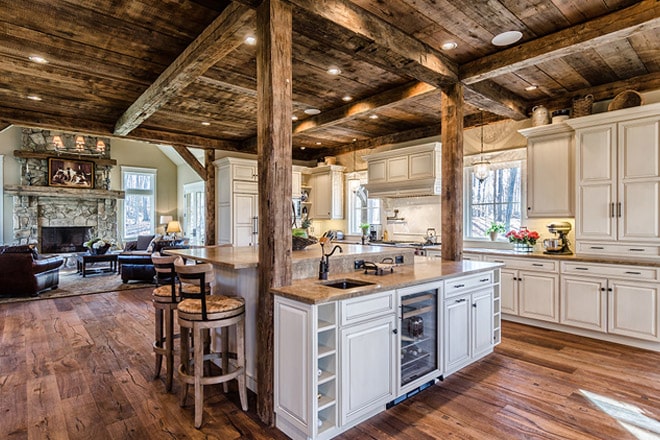
Locate an element on the screen. This screenshot has width=660, height=440. cabinets is located at coordinates (633, 308), (576, 307), (539, 300), (509, 294), (587, 222), (644, 218), (486, 323), (461, 331), (356, 356).